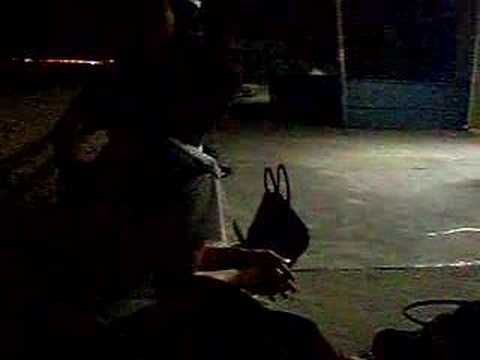
In order to click on wall in this screenshot , I will do `click(398, 114)`.